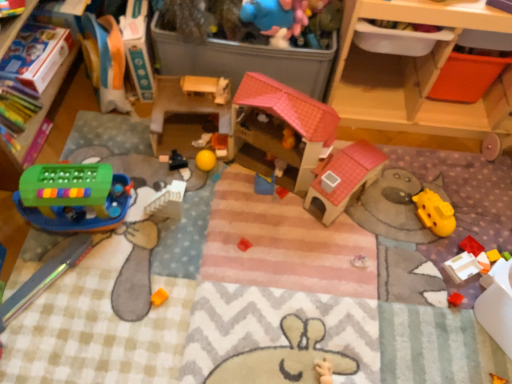
You are a GUI agent. You are given a task and a screenshot of the screen. Output one action in this format:
    pyautogui.click(x=<x>, y=<y>)
    Task: Click on the vacant space that's between white matte figurine at center, which ranks as the 4th toy in left-to-right order, and yellow plastic spoon at center, the 7th toy when ordered from left to right
    
    Given the screenshot: What is the action you would take?
    pyautogui.click(x=238, y=173)